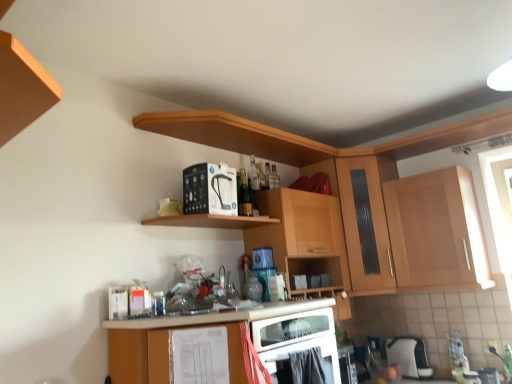
What do you see at coordinates (209, 189) in the screenshot? I see `black plastic water filter at upper center, which is the first appliance in top-to-bottom order` at bounding box center [209, 189].

You are a GUI agent. You are given a task and a screenshot of the screen. Output one action in this format:
    pyautogui.click(x=<x>, y=<y>)
    Task: Click on the matte wood cabinet at lower center, acting as the first cabinetry starting from the left
    The image size is (512, 384).
    Given the screenshot: What is the action you would take?
    pyautogui.click(x=218, y=343)

You are a GUI agent. You are given a task and a screenshot of the screen. Output one action in this format:
    pyautogui.click(x=<x>, y=<y>)
    Task: Click on the wooden cabinet at upper center, arranged as the second cabinetry when viewed from the left
    
    Given the screenshot: What is the action you would take?
    pyautogui.click(x=303, y=237)

How much space does wooden cabinet at upper center, arranged as the second cabinetry when viewed from the left, occupy horizontally?

The width of wooden cabinet at upper center, arranged as the second cabinetry when viewed from the left, is 12.53 inches.

The height and width of the screenshot is (384, 512). What do you see at coordinates (489, 376) in the screenshot? I see `metallic silver toaster at lower right, the second appliance in the top-to-bottom sequence` at bounding box center [489, 376].

Where is `white plastic toaster at lower right, positioned as the third appliance in front-to-back order`? The height and width of the screenshot is (384, 512). white plastic toaster at lower right, positioned as the third appliance in front-to-back order is located at coordinates (409, 356).

From the image's perspective, who appears lower, matte wood cabinet at lower center, acting as the 3th cabinetry starting from the right, or white plastic toaster at lower right, which is the first appliance from back to front?

white plastic toaster at lower right, which is the first appliance from back to front, appears lower in the image.

In terms of height, does matte wood cabinet at lower center, acting as the first cabinetry starting from the left, look taller or shorter compared to white plastic toaster at lower right, which is the first appliance from back to front?

Clearly, matte wood cabinet at lower center, acting as the first cabinetry starting from the left, is taller compared to white plastic toaster at lower right, which is the first appliance from back to front.

Does matte wood cabinet at lower center, acting as the first cabinetry starting from the left, have a greater width compared to white plastic toaster at lower right, which is counted as the third appliance, starting from the top?

Correct, the width of matte wood cabinet at lower center, acting as the first cabinetry starting from the left, exceeds that of white plastic toaster at lower right, which is counted as the third appliance, starting from the top.

Can you tell me how much matte wood cabinet at lower center, acting as the 3th cabinetry starting from the right, and white plastic toaster at lower right, positioned as the third appliance in front-to-back order, differ in facing direction?

8.52 degrees.

From a real-world perspective, is white plastic toaster at lower right, the 1th appliance from the bottom, physically located above or below wooden shelf at upper center, the 1th shelf ordered from the bottom?

white plastic toaster at lower right, the 1th appliance from the bottom, is below wooden shelf at upper center, the 1th shelf ordered from the bottom.

Considering the relative sizes of white plastic toaster at lower right, the 1th appliance from the bottom, and wooden shelf at upper center, the 1th shelf ordered from the bottom, in the image provided, is white plastic toaster at lower right, the 1th appliance from the bottom, smaller than wooden shelf at upper center, the 1th shelf ordered from the bottom,?

No, white plastic toaster at lower right, the 1th appliance from the bottom, is not smaller than wooden shelf at upper center, the 1th shelf ordered from the bottom.

Which shelf is the 2nd one when counting from the front of the white plastic toaster at lower right, the 2th appliance positioned from the left? Please provide its 2D coordinates.

[(211, 221)]

Consider the image. How far apart are white plastic toaster at lower right, the second appliance from the right, and wooden shelf at upper center, the 1th shelf ordered from the bottom?

white plastic toaster at lower right, the second appliance from the right, is 1.49 meters away from wooden shelf at upper center, the 1th shelf ordered from the bottom.

From the image's perspective, is wooden at upper center, which is the first shelf from top to bottom, on top of wooden shelf at upper center, the 1th shelf ordered from the bottom?

Yes, from the image's perspective, wooden at upper center, which is the first shelf from top to bottom, is above wooden shelf at upper center, the 1th shelf ordered from the bottom.

I want to click on shelf above the wooden shelf at upper center, which is the second shelf in top-to-bottom order (from a real-world perspective), so click(236, 135).

Is wooden at upper center, placed as the 2th shelf when sorted from bottom to top, far from wooden shelf at upper center, which is the second shelf in top-to-bottom order?

No, wooden at upper center, placed as the 2th shelf when sorted from bottom to top, is not far away from wooden shelf at upper center, which is the second shelf in top-to-bottom order.

Is wooden at upper center, which is the first shelf from top to bottom, turned away from wooden shelf at upper center, the 1th shelf ordered from the bottom?

No, wooden shelf at upper center, the 1th shelf ordered from the bottom, is not at the back of wooden at upper center, which is the first shelf from top to bottom.

Would you say wooden shelf at upper center, which is the second shelf in top-to-bottom order, contains metallic silver toaster at lower right, the second appliance in the front-to-back sequence?

Definitely not — metallic silver toaster at lower right, the second appliance in the front-to-back sequence, is not inside wooden shelf at upper center, which is the second shelf in top-to-bottom order.

Is wooden shelf at upper center, which is the second shelf in top-to-bottom order, facing away from metallic silver toaster at lower right, acting as the first appliance starting from the right?

wooden shelf at upper center, which is the second shelf in top-to-bottom order, does not have its back to metallic silver toaster at lower right, acting as the first appliance starting from the right.

Who is more distant, wooden shelf at upper center, the 1th shelf ordered from the bottom, or metallic silver toaster at lower right, the second appliance in the front-to-back sequence?

metallic silver toaster at lower right, the second appliance in the front-to-back sequence.

Looking at their sizes, would you say wooden shelf at upper center, which is the second shelf in top-to-bottom order, is wider or thinner than metallic silver toaster at lower right, which ranks as the 2th appliance in bottom-to-top order?

wooden shelf at upper center, which is the second shelf in top-to-bottom order, is wider than metallic silver toaster at lower right, which ranks as the 2th appliance in bottom-to-top order.

Considering the relative sizes of white plastic toaster at lower right, the 1th appliance from the bottom, and wooden at upper center, placed as the 2th shelf when sorted from bottom to top, in the image provided, is white plastic toaster at lower right, the 1th appliance from the bottom, shorter than wooden at upper center, placed as the 2th shelf when sorted from bottom to top,?

No.

Consider the image. Which is further, (422, 363) or (332, 153)?

The point (422, 363) is farther from the camera.

Looking at their sizes, would you say white plastic toaster at lower right, the second appliance from the right, is wider or thinner than wooden at upper center, placed as the 2th shelf when sorted from bottom to top?

In the image, white plastic toaster at lower right, the second appliance from the right, appears to be more narrow than wooden at upper center, placed as the 2th shelf when sorted from bottom to top.

From a real-world perspective, is white plastic toaster at lower right, the second appliance from the right, positioned under wooden at upper center, which is the first shelf from top to bottom, based on gravity?

Correct, in the physical world, white plastic toaster at lower right, the second appliance from the right, is lower than wooden at upper center, which is the first shelf from top to bottom.

Looking at their sizes, would you say metallic silver toaster at lower right, which ranks as the 2th appliance in bottom-to-top order, is wider or thinner than white plastic toaster at lower right, positioned as the third appliance in front-to-back order?

In the image, metallic silver toaster at lower right, which ranks as the 2th appliance in bottom-to-top order, appears to be more narrow than white plastic toaster at lower right, positioned as the third appliance in front-to-back order.

From the image's perspective, is metallic silver toaster at lower right, which ranks as the 2th appliance in bottom-to-top order, over white plastic toaster at lower right, which is counted as the third appliance, starting from the top?

Yes, from the image's perspective, metallic silver toaster at lower right, which ranks as the 2th appliance in bottom-to-top order, is on top of white plastic toaster at lower right, which is counted as the third appliance, starting from the top.

Which is behind, point (481, 380) or point (392, 349)?

The point (392, 349) is farther.

Find the location of a particular element. Image resolution: width=512 pixels, height=384 pixels. appliance located on the right of white plastic toaster at lower right, which is counted as the third appliance, starting from the top is located at coordinates (489, 376).

Consider the image. Is wooden at upper center, which is the first shelf from top to bottom, wider than wooden cabinet at upper right, which is counted as the first cabinetry, starting from the right?

No, wooden at upper center, which is the first shelf from top to bottom, is not wider than wooden cabinet at upper right, which is counted as the first cabinetry, starting from the right.

Can you confirm if wooden at upper center, which is the first shelf from top to bottom, is smaller than wooden cabinet at upper right, the third cabinetry positioned from the left?

Yes, wooden at upper center, which is the first shelf from top to bottom, is smaller than wooden cabinet at upper right, the third cabinetry positioned from the left.

Can we say wooden at upper center, which is the first shelf from top to bottom, lies outside wooden cabinet at upper right, the third cabinetry positioned from the left?

Absolutely, wooden at upper center, which is the first shelf from top to bottom, is external to wooden cabinet at upper right, the third cabinetry positioned from the left.

From the image's perspective, between wooden at upper center, which is the first shelf from top to bottom, and wooden cabinet at upper right, which is counted as the first cabinetry, starting from the right, which one is located above?

wooden at upper center, which is the first shelf from top to bottom, from the image's perspective.

In order to click on the 1st appliance below the matte wood cabinet at lower center, acting as the 3th cabinetry starting from the right (from a real-world perspective) in this screenshot , I will do `click(409, 356)`.

The width and height of the screenshot is (512, 384). I want to click on appliance that is the 2nd one when counting downward from the wooden shelf at upper center, which is the second shelf in top-to-bottom order (from the image's perspective), so click(409, 356).

Looking at the image, which one is located closer to wooden cabinet at upper right, the third cabinetry positioned from the left, white plastic toaster at lower right, which is counted as the third appliance, starting from the top, or black plastic water filter at upper center, the first appliance viewed from the left?

white plastic toaster at lower right, which is counted as the third appliance, starting from the top.

When comparing their distances from white plastic toaster at lower right, the second appliance from the right, does metallic silver toaster at lower right, the second appliance in the front-to-back sequence, or wooden cabinet at upper right, the third cabinetry positioned from the left, seem further?

wooden cabinet at upper right, the third cabinetry positioned from the left, is further to white plastic toaster at lower right, the second appliance from the right.

When comparing their distances from wooden at upper center, which is the first shelf from top to bottom, does black plastic water filter at upper center, the 3th appliance viewed from the right, or wooden cabinet at upper right, the third cabinetry positioned from the left, seem further?

Based on the image, wooden cabinet at upper right, the third cabinetry positioned from the left, appears to be further to wooden at upper center, which is the first shelf from top to bottom.

Considering their positions, is metallic silver toaster at lower right, which ranks as the 2th appliance in bottom-to-top order, positioned further to wooden cabinet at upper right, the third cabinetry positioned from the left, than wooden cabinet at upper center, arranged as the 2th cabinetry when viewed from the right?

metallic silver toaster at lower right, which ranks as the 2th appliance in bottom-to-top order, lies further to wooden cabinet at upper right, the third cabinetry positioned from the left, than the other object.

Estimate the real-world distances between objects in this image. Which object is closer to wooden cabinet at upper right, the third cabinetry positioned from the left, wooden at upper center, which is the first shelf from top to bottom, or white plastic toaster at lower right, which is counted as the third appliance, starting from the top?

Based on the image, white plastic toaster at lower right, which is counted as the third appliance, starting from the top, appears to be nearer to wooden cabinet at upper right, the third cabinetry positioned from the left.

Estimate the real-world distances between objects in this image. Which object is closer to wooden cabinet at upper center, arranged as the second cabinetry when viewed from the left, wooden cabinet at upper right, which is counted as the first cabinetry, starting from the right, or wooden at upper center, placed as the 2th shelf when sorted from bottom to top?

wooden at upper center, placed as the 2th shelf when sorted from bottom to top.

Based on the photo, from the image, which object appears to be farther from wooden cabinet at upper center, arranged as the second cabinetry when viewed from the left, black plastic water filter at upper center, the 3th appliance viewed from the right, or matte wood cabinet at lower center, acting as the first cabinetry starting from the left?

matte wood cabinet at lower center, acting as the first cabinetry starting from the left.

In the scene shown: From the image, which object appears to be nearer to wooden shelf at upper center, which is the second shelf in top-to-bottom order, wooden at upper center, placed as the 2th shelf when sorted from bottom to top, or wooden cabinet at upper right, which is counted as the first cabinetry, starting from the right?

The object closer to wooden shelf at upper center, which is the second shelf in top-to-bottom order, is wooden at upper center, placed as the 2th shelf when sorted from bottom to top.

This screenshot has height=384, width=512. Identify the location of shelf situated between wooden shelf at upper center, which is the second shelf in top-to-bottom order, and metallic silver toaster at lower right, the third appliance in the left-to-right sequence, from left to right. (236, 135).

This screenshot has height=384, width=512. I want to click on appliance that lies between wooden at upper center, which is the first shelf from top to bottom, and wooden shelf at upper center, the 1th shelf ordered from the bottom, from top to bottom, so click(209, 189).

The width and height of the screenshot is (512, 384). In order to click on shelf between matte wood cabinet at lower center, acting as the first cabinetry starting from the left, and wooden cabinet at upper right, the third cabinetry positioned from the left, in the horizontal direction in this screenshot , I will do `click(236, 135)`.

I want to click on appliance between black plastic water filter at upper center, acting as the third appliance starting from the back, and metallic silver toaster at lower right, acting as the first appliance starting from the right, from left to right, so click(409, 356).